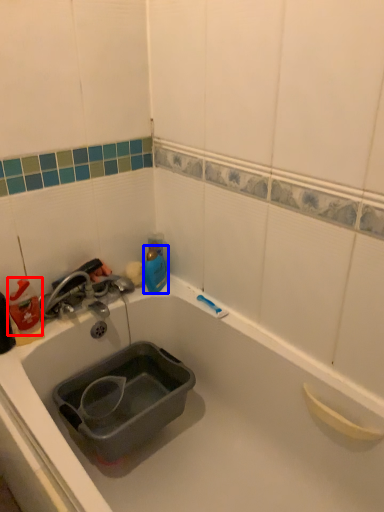
Question: Which point is closer to the camera, cleaning product (highlighted by a red box) or bottle (highlighted by a blue box)?

Choices:
 (A) cleaning product
 (B) bottle

Answer: (A)